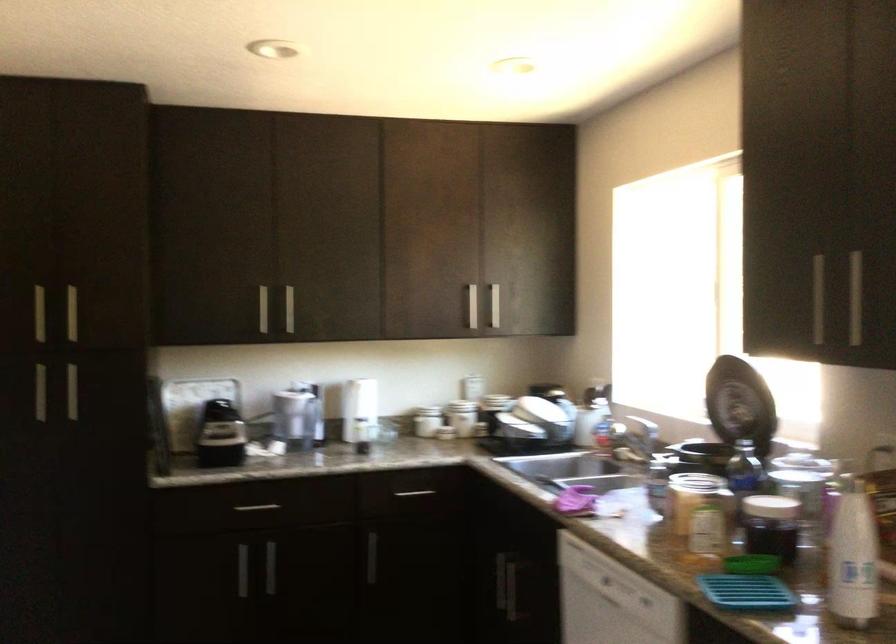
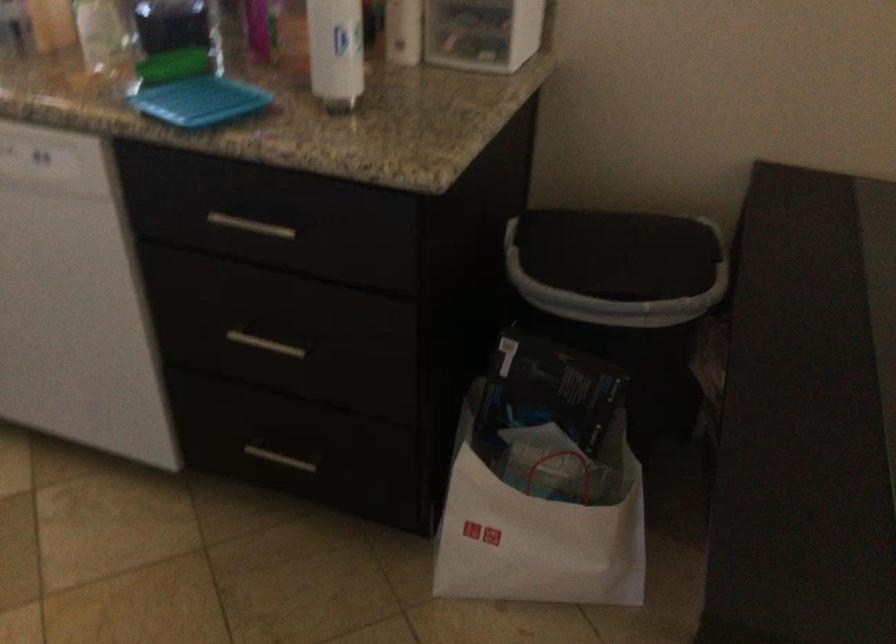
Based on the continuous images, in which direction is the camera rotating?

The rotation direction of the camera is right-down.